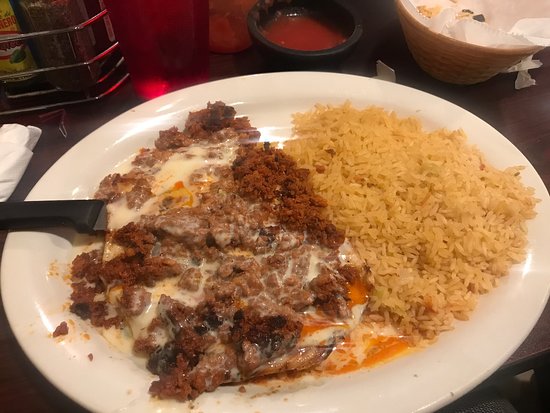
What are the coordinates of `1 napkin` in the screenshot? It's located at (3, 153).